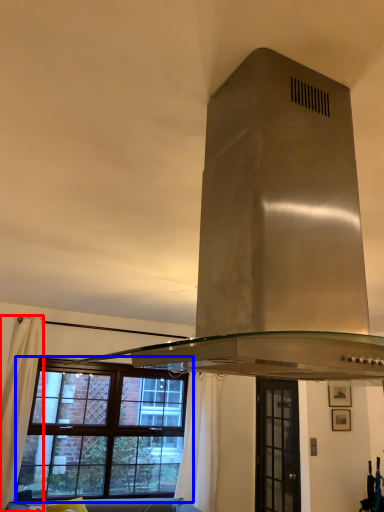
Question: Which object appears closest to the camera in this image, curtain (highlighted by a red box) or window (highlighted by a blue box)?

Choices:
 (A) curtain
 (B) window

Answer: (A)